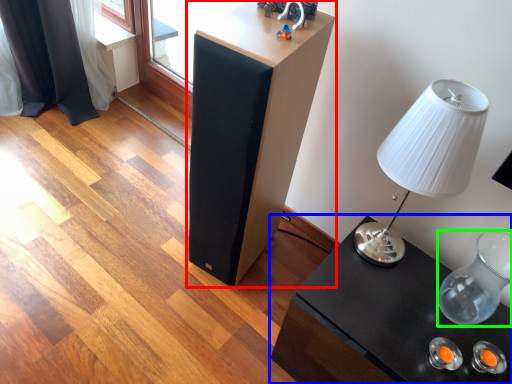
Question: Estimate the real-world distances between objects in this image. Which object is closer to furniture (highlighted by a red box), table (highlighted by a blue box) or glass vase (highlighted by a green box)?

Choices:
 (A) table
 (B) glass vase

Answer: (A)